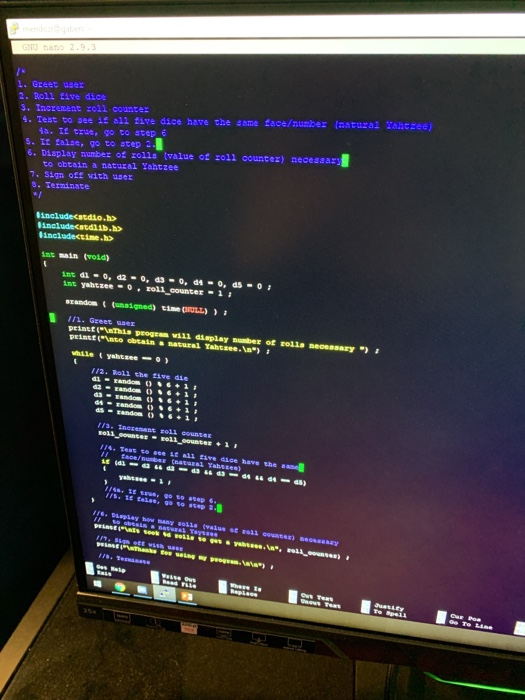
At what (x,y) coordinates should I click in order to perform the action: click on wooden border. Please return your answer as a coordinate pair (x, y). The width and height of the screenshot is (525, 700). Looking at the image, I should click on (51, 592).